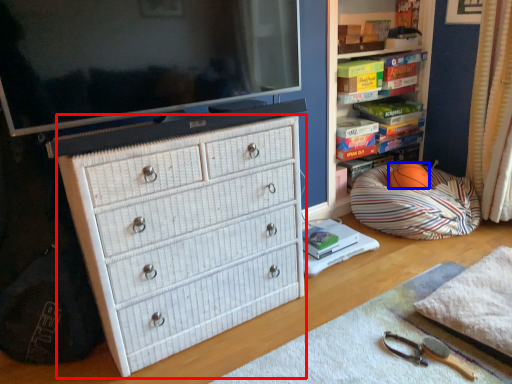
Question: Among these objects, which one is farthest to the camera, chest of drawers (highlighted by a red box) or ball (highlighted by a blue box)?

Choices:
 (A) chest of drawers
 (B) ball

Answer: (B)